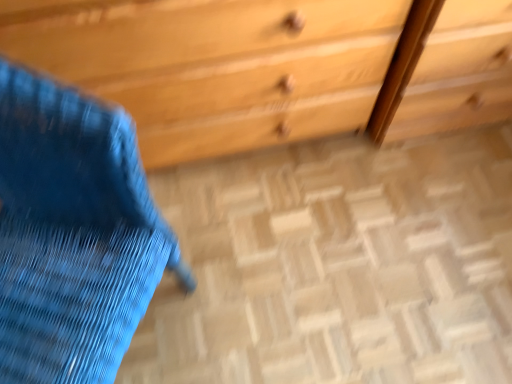
Question: Is wooden chest of drawers at upper center next to wooden floor at center?

Choices:
 (A) yes
 (B) no

Answer: (B)

Question: Can you confirm if wooden chest of drawers at upper center is thinner than wooden floor at center?

Choices:
 (A) no
 (B) yes

Answer: (B)

Question: Is wooden chest of drawers at upper center positioned in front of wooden floor at center?

Choices:
 (A) no
 (B) yes

Answer: (B)

Question: From the image's perspective, would you say wooden chest of drawers at upper center is positioned over wooden floor at center?

Choices:
 (A) no
 (B) yes

Answer: (B)

Question: Is wooden chest of drawers at upper center positioned far away from wooden floor at center?

Choices:
 (A) yes
 (B) no

Answer: (B)

Question: From a real-world perspective, is wooden chest of drawers at upper center above or below blue fabric swivel chair at left?

Choices:
 (A) above
 (B) below

Answer: (B)

Question: From the image's perspective, is wooden chest of drawers at upper center above or below blue fabric swivel chair at left?

Choices:
 (A) above
 (B) below

Answer: (A)

Question: Is point (285, 6) positioned closer to the camera than point (115, 155)?

Choices:
 (A) closer
 (B) farther

Answer: (B)

Question: Considering the positions of wooden chest of drawers at upper center and blue fabric swivel chair at left in the image, is wooden chest of drawers at upper center bigger or smaller than blue fabric swivel chair at left?

Choices:
 (A) small
 (B) big

Answer: (B)

Question: Is point (32, 266) positioned closer to the camera than point (424, 71)?

Choices:
 (A) closer
 (B) farther

Answer: (A)

Question: Is blue fabric swivel chair at left inside the boundaries of wooden chest of drawers at upper center, or outside?

Choices:
 (A) outside
 (B) inside

Answer: (A)

Question: Considering the positions of blue fabric swivel chair at left and wooden chest of drawers at upper center in the image, is blue fabric swivel chair at left bigger or smaller than wooden chest of drawers at upper center?

Choices:
 (A) big
 (B) small

Answer: (B)

Question: Would you say blue fabric swivel chair at left is to the left or to the right of wooden chest of drawers at upper center in the picture?

Choices:
 (A) right
 (B) left

Answer: (B)

Question: Relative to wooden floor at center, is wooden chest of drawers at upper center in front or behind?

Choices:
 (A) behind
 (B) front

Answer: (B)

Question: Is wooden chest of drawers at upper center taller or shorter than wooden floor at center?

Choices:
 (A) tall
 (B) short

Answer: (A)